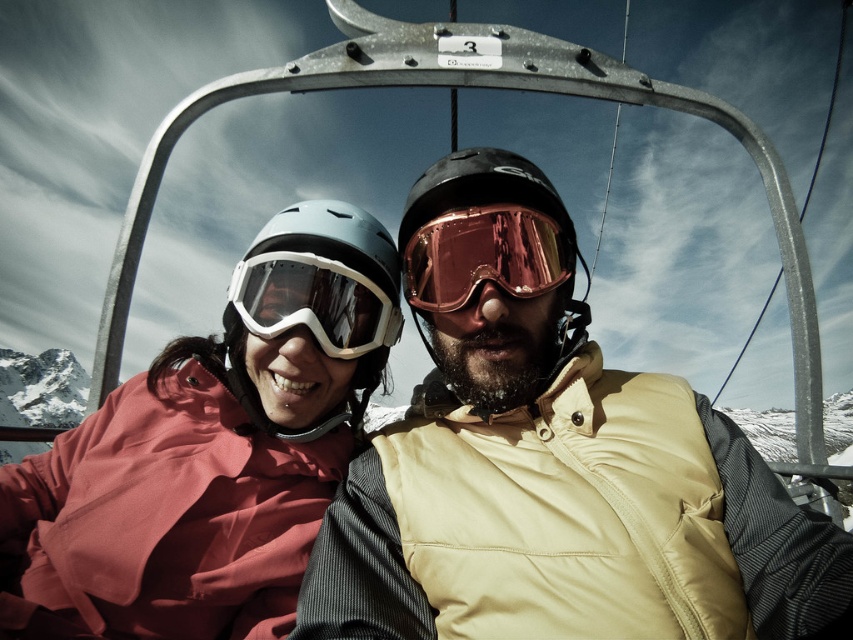
You are a designer creating a size chart for winter gear. You have a matte yellow jacket at center and transparent matte ski goggles at center. Which item has a smaller width?

The matte yellow jacket at center has a smaller width than the transparent matte ski goggles at center.

You are a photographer positioned at the base of the mountain, aiming to capture a photo of the two people on the ski lift. You notice two points marked in the scene. Which of the two points, point (483, 556) or point (300, 308), is closer to your camera lens?

Point (483, 556) is closer to the viewer than point (300, 308), so it is the point closer to your camera lens.

You are a photographer trying to capture a clear shot of the matte yellow jacket at center and the glossy plastic helmet at center from the front. Which object should you focus on first if you want to ensure both are in focus?

The matte yellow jacket at center is positioned on the left side of the glossy plastic helmet at center, so you should focus on the matte yellow jacket at center first to ensure both are in focus.